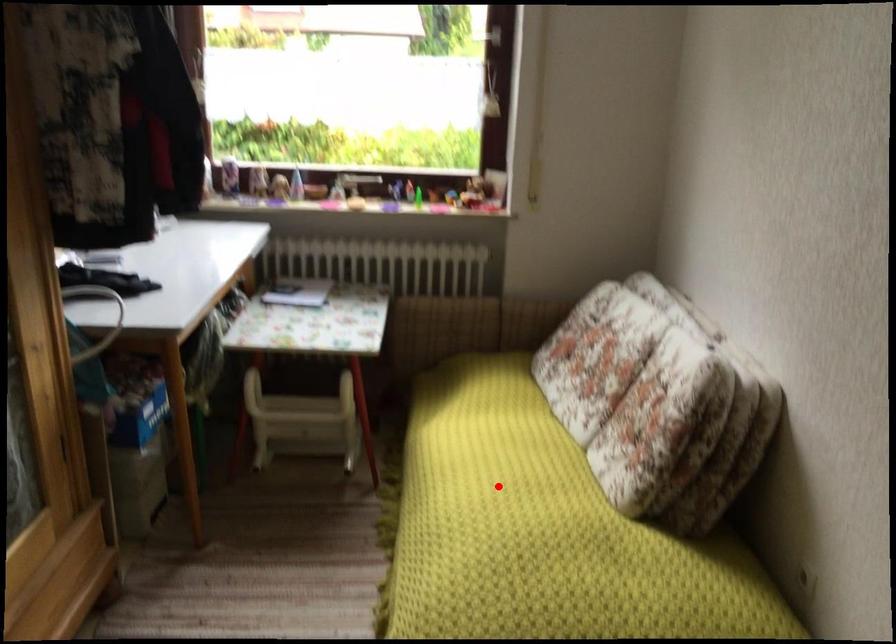
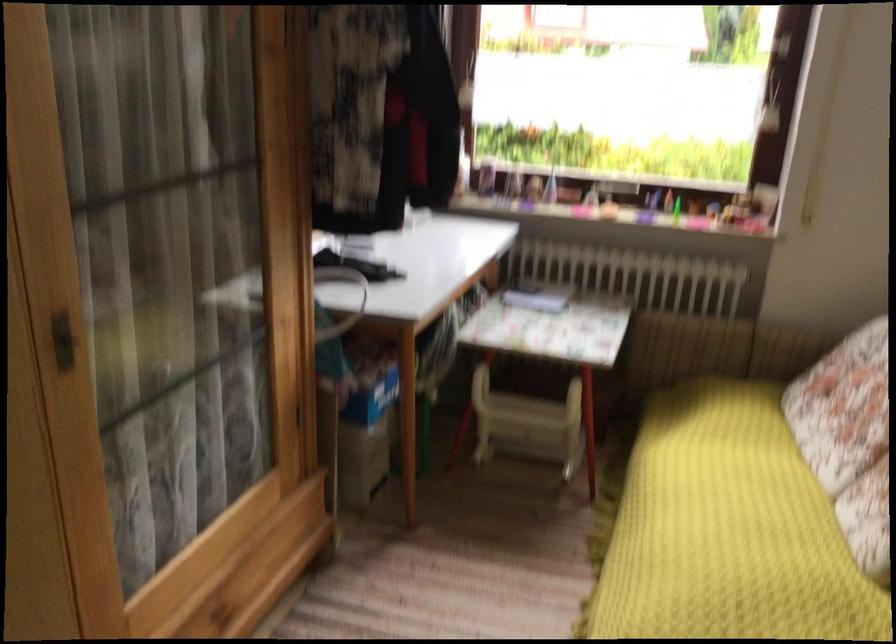
In the second image, find the point that corresponds to the highlighted location in the first image.

(728, 529)